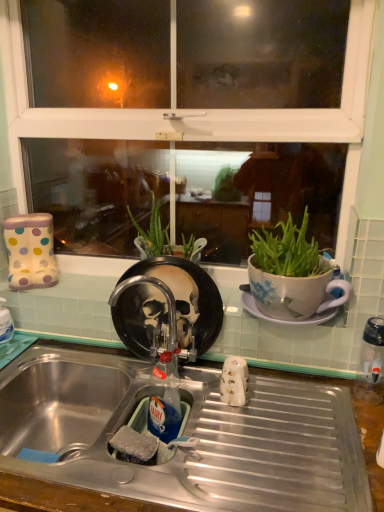
Locate an element on the screen. free point above metallic stainless steel sink at lower center (from a real-world perspective) is located at coordinates (226, 430).